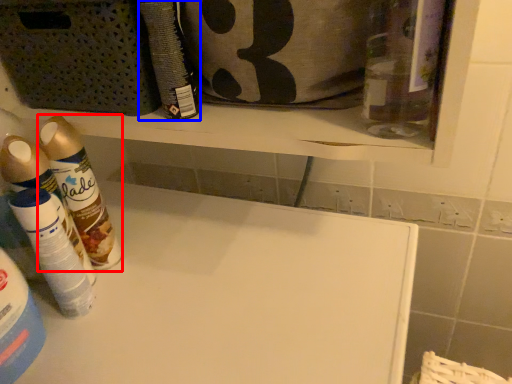
Question: Among these objects, which one is nearest to the camera, cleaning product (highlighted by a red box) or cleaning product (highlighted by a blue box)?

Choices:
 (A) cleaning product
 (B) cleaning product

Answer: (B)